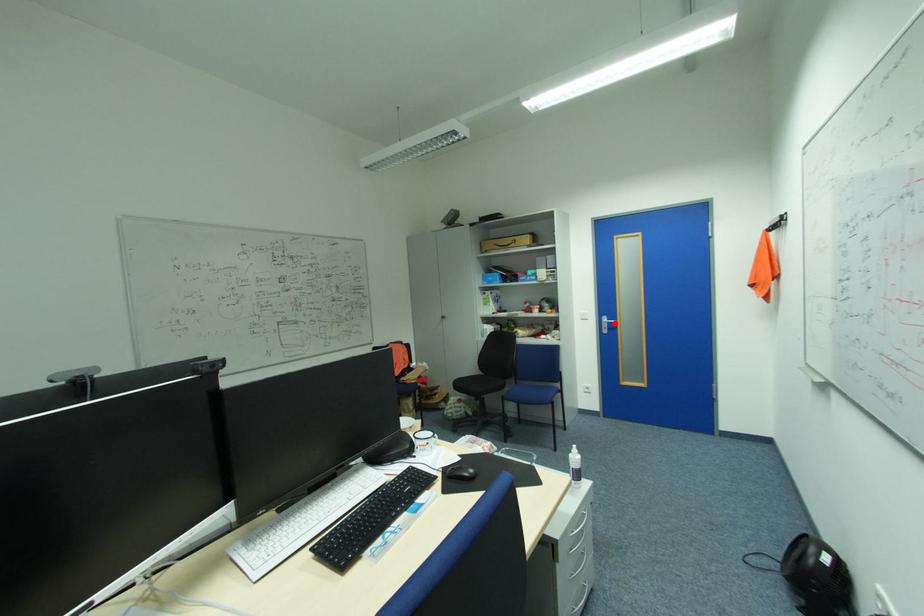
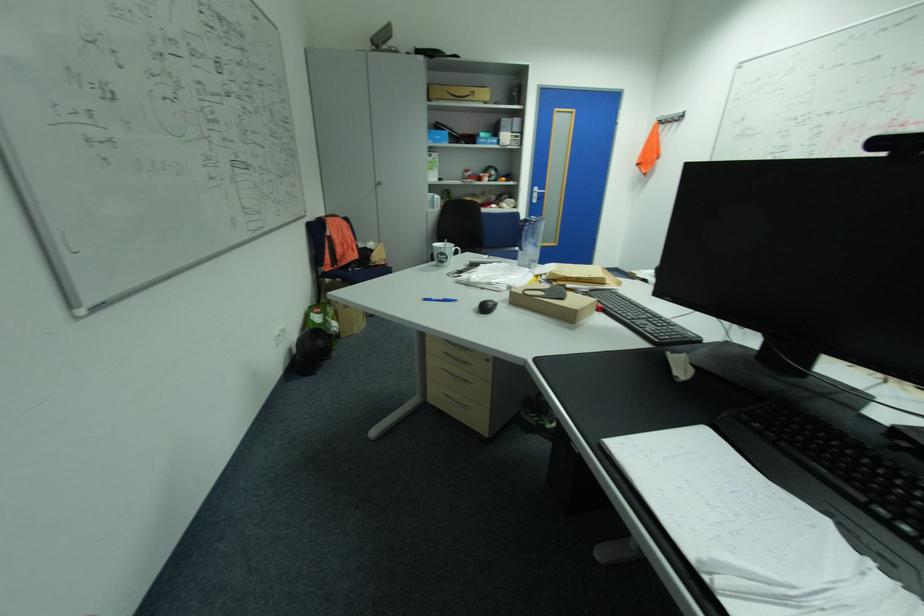
Locate, in the second image, the point that corresponds to the highlighted location in the first image.

(544, 193)